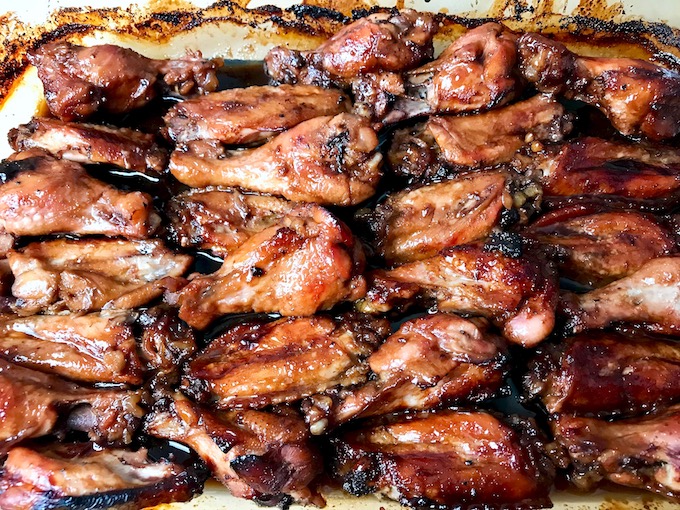
I want to click on dish, so click(247, 54).